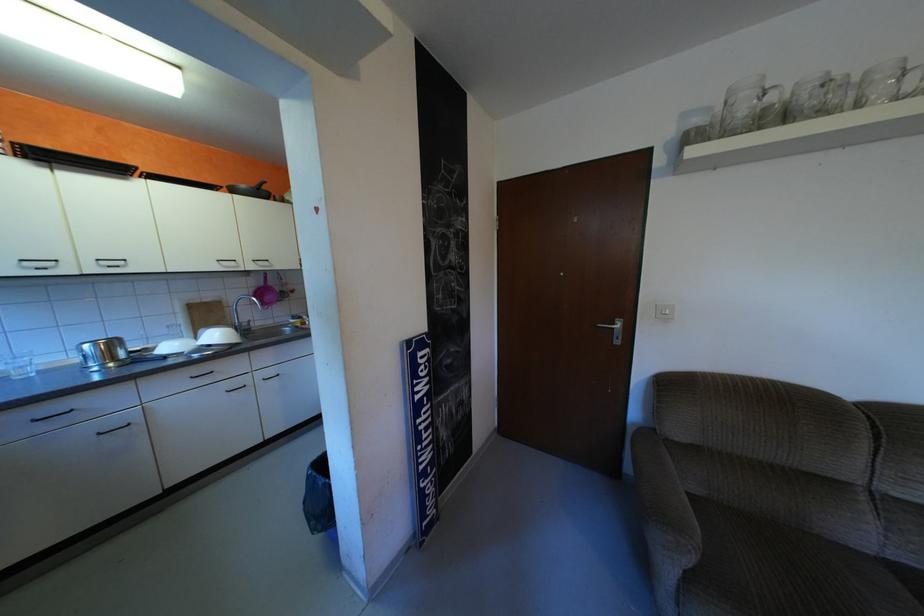
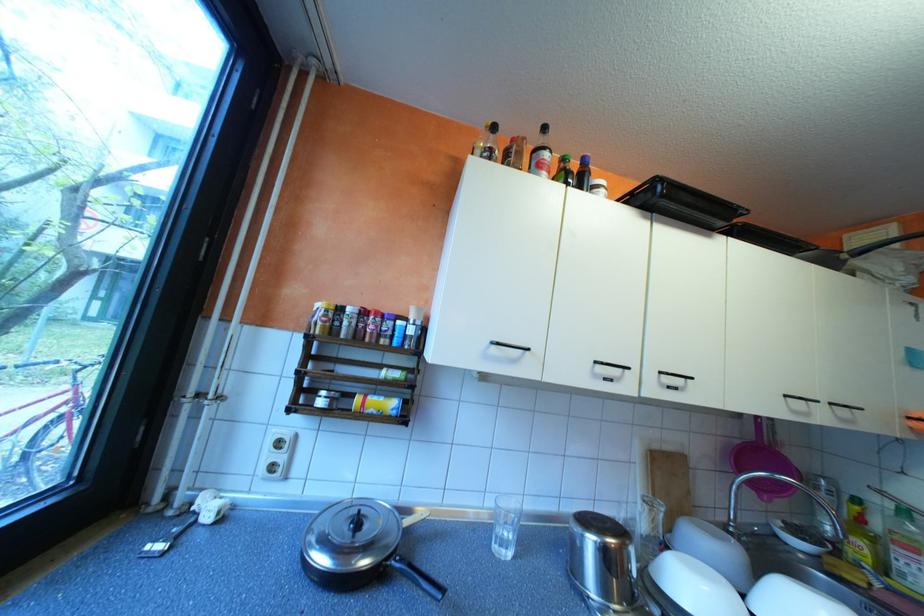
In the second image, find the point that corresponds to pixel 113 265 in the first image.

(673, 383)